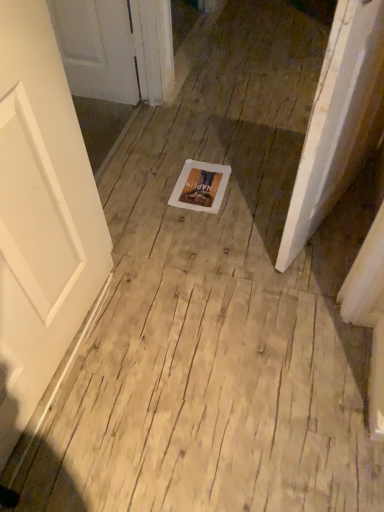
Identify the location of free point above white paper at center (from a real-world perspective). (199, 186).